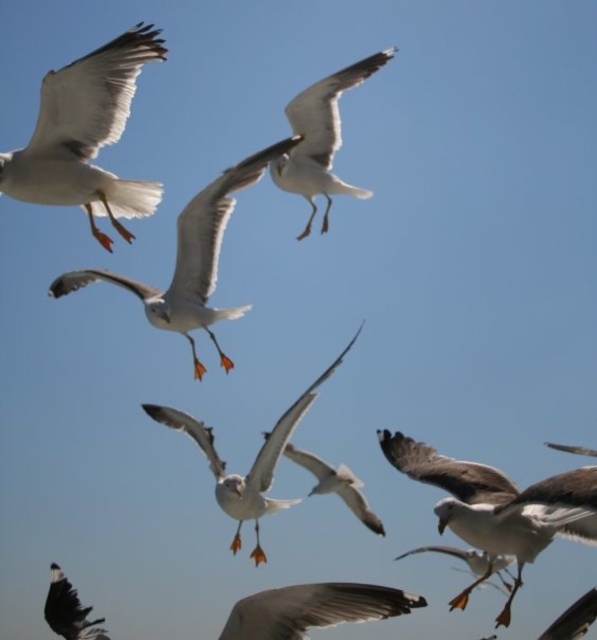
You are a birdwatcher observing two seagulls in the sky. You see the white feathered seagull at lower right and the white feathered seagull at lower center. Which seagull is positioned more to the east if the sun is setting in the west?

The white feathered seagull at lower right is positioned more to the east because it is to the right of the white feathered seagull at lower center, and since the sun is setting in the west, the right side of the image corresponds to the east direction.

You are a birdwatcher observing two seagulls in the sky. You see the white feathered seagull at lower right and the white feathered seagull at lower center. Which seagull appears larger in the image?

The white feathered seagull at lower right appears larger because it is taller than the white feathered seagull at lower center.

You are a photographer trying to capture both the white matte seagull at upper left and the white feathered seagull at lower center in a single shot. Based on their sizes in the image, which seagull would appear smaller in the photo?

The white matte seagull at upper left would appear smaller in the photo because it occupies less space than the white feathered seagull at lower center.